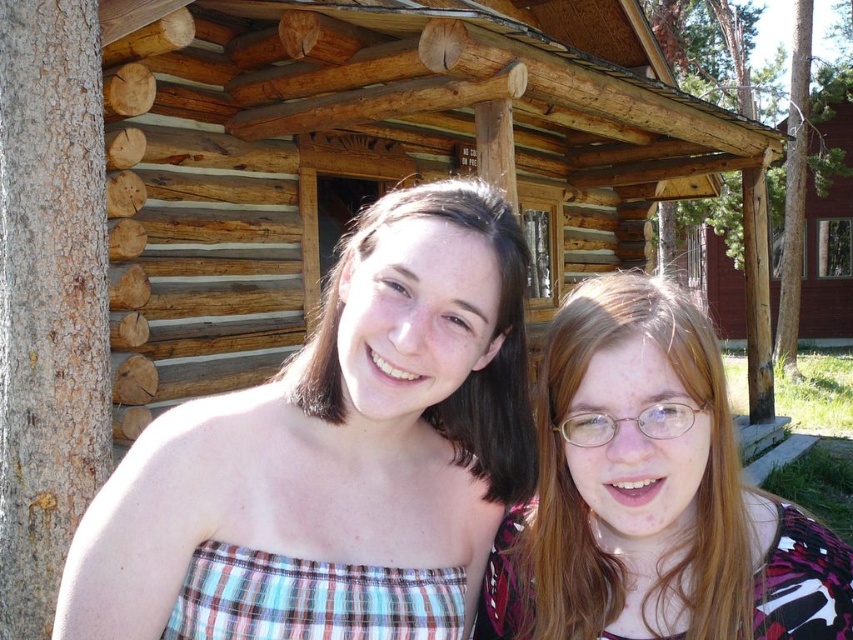
Question: Based on their relative distances, which object is farther from the matte brown hair at center?

Choices:
 (A) wooden cabin at upper right
 (B) plaid fabric top at center
 (C) clear plastic glasses at center

Answer: (A)

Question: Is clear plastic glasses at center smaller than wooden cabin at upper right?

Choices:
 (A) no
 (B) yes

Answer: (B)

Question: Which point is closer to the camera?

Choices:
 (A) (529, 454)
 (B) (828, 310)
 (C) (282, 483)

Answer: (C)

Question: Which object appears farthest from the camera in this image?

Choices:
 (A) clear plastic glasses at center
 (B) matte brown hair at center

Answer: (B)

Question: Observing the image, what is the correct spatial positioning of clear plastic glasses at center in reference to wooden cabin at upper right?

Choices:
 (A) right
 (B) left

Answer: (B)

Question: Is plaid fabric top at center wider than clear plastic glasses at center?

Choices:
 (A) no
 (B) yes

Answer: (B)